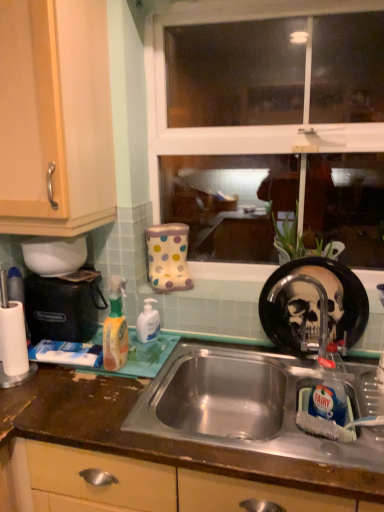
The height and width of the screenshot is (512, 384). In order to click on vacant space in front of white glossy hand soap at center, placed as the second cleaning product when sorted from left to right in this screenshot , I will do `click(147, 359)`.